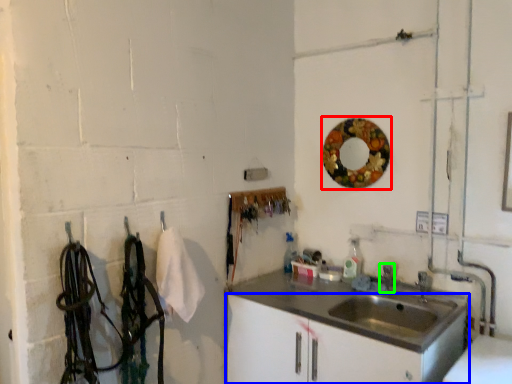
Question: Which is nearer to the mirror (highlighted by a red box)? bathroom cabinet (highlighted by a blue box) or faucet (highlighted by a green box).

Choices:
 (A) bathroom cabinet
 (B) faucet

Answer: (B)